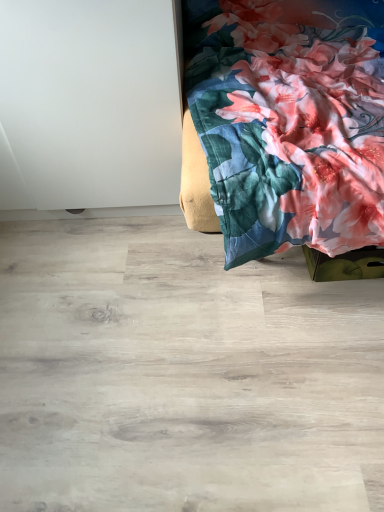
Question: Should I look upward or downward to see floral fabric bedspread at upper right?

Choices:
 (A) up
 (B) down

Answer: (A)

Question: From a real-world perspective, is floral fabric bedspread at upper right beneath natural wood floor at lower center?

Choices:
 (A) no
 (B) yes

Answer: (A)

Question: Does floral fabric bedspread at upper right have a greater height compared to natural wood floor at lower center?

Choices:
 (A) no
 (B) yes

Answer: (B)

Question: Can you confirm if floral fabric bedspread at upper right is shorter than natural wood floor at lower center?

Choices:
 (A) no
 (B) yes

Answer: (A)

Question: From the image's perspective, would you say floral fabric bedspread at upper right is shown under natural wood floor at lower center?

Choices:
 (A) yes
 (B) no

Answer: (B)

Question: Considering the relative positions of floral fabric bedspread at upper right and natural wood floor at lower center in the image provided, is floral fabric bedspread at upper right behind natural wood floor at lower center?

Choices:
 (A) yes
 (B) no

Answer: (B)

Question: Is floral fabric bedspread at upper right turned away from natural wood floor at lower center?

Choices:
 (A) no
 (B) yes

Answer: (A)

Question: Considering the relative sizes of natural wood floor at lower center and floral fabric bedspread at upper right in the image provided, is natural wood floor at lower center shorter than floral fabric bedspread at upper right?

Choices:
 (A) yes
 (B) no

Answer: (A)

Question: Does natural wood floor at lower center have a greater width compared to floral fabric bedspread at upper right?

Choices:
 (A) no
 (B) yes

Answer: (B)

Question: Could you tell me if natural wood floor at lower center is facing floral fabric bedspread at upper right?

Choices:
 (A) yes
 (B) no

Answer: (B)

Question: Can you confirm if natural wood floor at lower center is positioned to the left of floral fabric bedspread at upper right?

Choices:
 (A) no
 (B) yes

Answer: (B)

Question: From the image's perspective, is natural wood floor at lower center over floral fabric bedspread at upper right?

Choices:
 (A) no
 (B) yes

Answer: (A)

Question: Is natural wood floor at lower center smaller than floral fabric bedspread at upper right?

Choices:
 (A) no
 (B) yes

Answer: (B)

Question: Considering the positions of floral fabric bedspread at upper right and natural wood floor at lower center in the image, is floral fabric bedspread at upper right taller or shorter than natural wood floor at lower center?

Choices:
 (A) tall
 (B) short

Answer: (A)